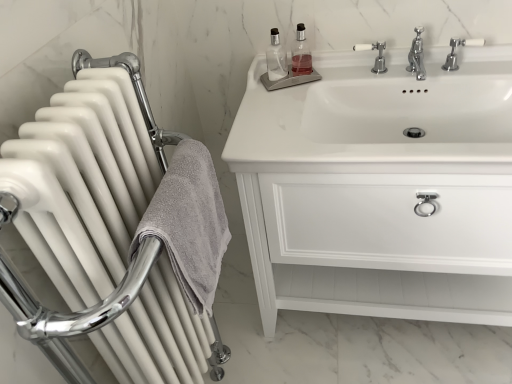
Find the location of a particular element. Image resolution: width=512 pixels, height=384 pixels. free space to the right of white plastic tap at upper right, marked as the 2th tap in a left-to-right arrangement is located at coordinates (490, 67).